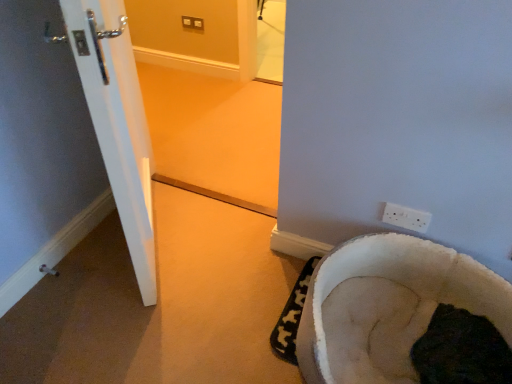
Question: Would you consider dark fur bed at lower right to be distant from white fluffy pet bed at lower right?

Choices:
 (A) no
 (B) yes

Answer: (A)

Question: Could you tell me if dark fur bed at lower right is facing white fluffy pet bed at lower right?

Choices:
 (A) yes
 (B) no

Answer: (B)

Question: Is dark fur bed at lower right taller than white fluffy pet bed at lower right?

Choices:
 (A) no
 (B) yes

Answer: (B)

Question: Is dark fur bed at lower right at the right side of white fluffy pet bed at lower right?

Choices:
 (A) yes
 (B) no

Answer: (A)

Question: Is dark fur bed at lower right closer to camera compared to white fluffy pet bed at lower right?

Choices:
 (A) yes
 (B) no

Answer: (A)

Question: Is dark fur bed at lower right located outside white fluffy pet bed at lower right?

Choices:
 (A) yes
 (B) no

Answer: (A)

Question: From the image's perspective, is white fluffy pet bed at lower right over white glossy door at lower left?

Choices:
 (A) no
 (B) yes

Answer: (A)

Question: Considering the relative positions of white fluffy pet bed at lower right and white glossy door at lower left in the image provided, is white fluffy pet bed at lower right to the left of white glossy door at lower left from the viewer's perspective?

Choices:
 (A) no
 (B) yes

Answer: (A)

Question: Considering the relative positions of white fluffy pet bed at lower right and white glossy door at lower left in the image provided, is white fluffy pet bed at lower right to the right of white glossy door at lower left from the viewer's perspective?

Choices:
 (A) yes
 (B) no

Answer: (A)

Question: Considering the relative sizes of white fluffy pet bed at lower right and white glossy door at lower left in the image provided, is white fluffy pet bed at lower right thinner than white glossy door at lower left?

Choices:
 (A) yes
 (B) no

Answer: (A)

Question: Is white fluffy pet bed at lower right oriented towards white glossy door at lower left?

Choices:
 (A) yes
 (B) no

Answer: (B)

Question: Does white fluffy pet bed at lower right come in front of white glossy door at lower left?

Choices:
 (A) yes
 (B) no

Answer: (A)

Question: Does dark fur bed at lower right lie in front of white plastic electric outlet at lower right?

Choices:
 (A) yes
 (B) no

Answer: (A)